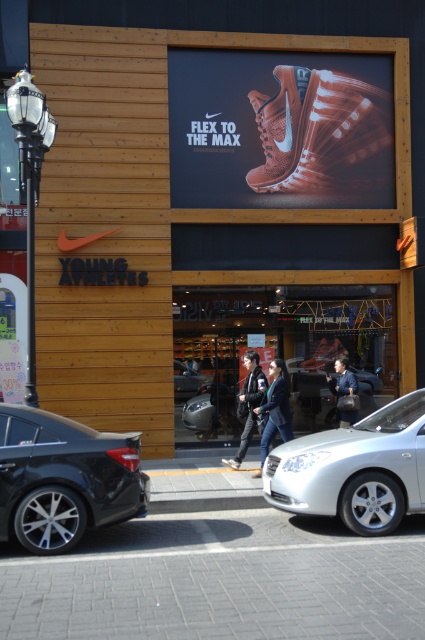
Between point (348, 129) and point (300, 502), which one is positioned behind?

The point (348, 129) is behind.

Looking at this image, between orange mesh shoe at upper center and silver metallic sedan at center, which one has less height?

silver metallic sedan at center is shorter.

Does point (365, 140) come farther from viewer compared to point (390, 474)?

That is True.

Where is `orange mesh shoe at upper center`? orange mesh shoe at upper center is located at coordinates (323, 132).

Does wooden signboard at upper center appear under dark blue jeans at center?

No, wooden signboard at upper center is not below dark blue jeans at center.

Can you confirm if wooden signboard at upper center is positioned to the left of dark blue jeans at center?

In fact, wooden signboard at upper center is to the right of dark blue jeans at center.

I want to click on wooden signboard at upper center, so click(x=155, y=218).

From the picture: Can you confirm if wooden signboard at upper center is taller than orange mesh shoe at upper center?

Incorrect, wooden signboard at upper center's height is not larger of orange mesh shoe at upper center's.

Does wooden signboard at upper center have a lesser height compared to orange mesh shoe at upper center?

Yes, wooden signboard at upper center is shorter than orange mesh shoe at upper center.

Does point (167, 371) come farther from viewer compared to point (297, 172)?

No, (167, 371) is in front of (297, 172).

Where is `wooden signboard at upper center`? wooden signboard at upper center is located at coordinates (155, 218).